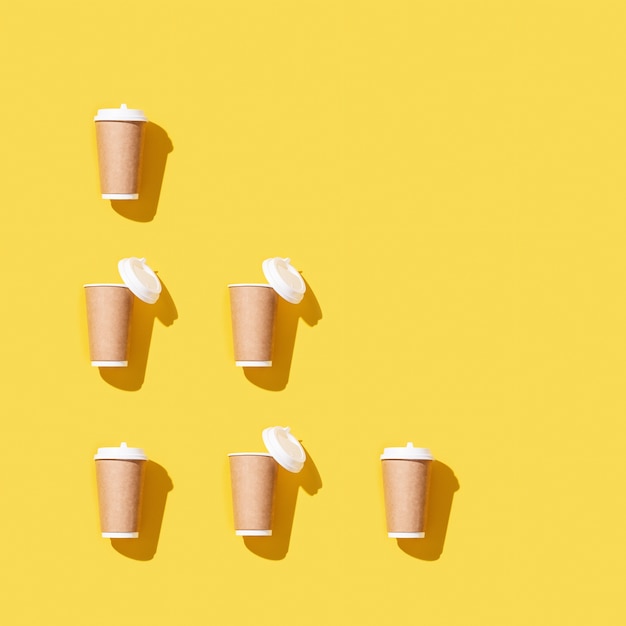
This screenshot has width=626, height=626. In order to click on cup lids in this screenshot , I will do `click(406, 451)`, `click(289, 451)`, `click(124, 451)`, `click(146, 284)`, `click(282, 285)`.